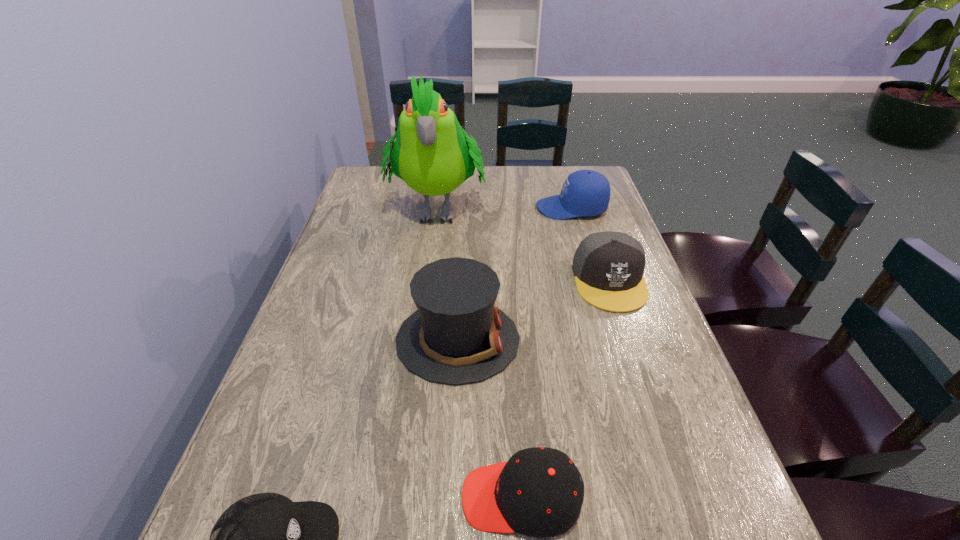
Find the location of a particular element. The height and width of the screenshot is (540, 960). the tallest object is located at coordinates (431, 154).

Where is `dress hat`? Image resolution: width=960 pixels, height=540 pixels. dress hat is located at coordinates (457, 336).

Find the location of a particular element. the farthest cap is located at coordinates (586, 193).

Locate an element on the screen. the third nearest cap is located at coordinates (608, 266).

Identify the location of free space located 0.350m on the beak of the parakeet. Image resolution: width=960 pixels, height=540 pixels. (420, 339).

Find the location of `free space located 0.120m with goggles on the front of the dress hat`. free space located 0.120m with goggles on the front of the dress hat is located at coordinates (574, 340).

The width and height of the screenshot is (960, 540). Find the location of `vacant space located on the front-facing side of the farthest cap`. vacant space located on the front-facing side of the farthest cap is located at coordinates (504, 208).

Locate an element on the screen. This screenshot has width=960, height=540. vacant space located on the front-facing side of the farthest cap is located at coordinates (479, 208).

Where is `free space located on the front-facing side of the farthest cap`? Image resolution: width=960 pixels, height=540 pixels. free space located on the front-facing side of the farthest cap is located at coordinates (450, 208).

Find the location of `vacant space positioned on the front-facing side of the second farthest cap`. vacant space positioned on the front-facing side of the second farthest cap is located at coordinates (678, 485).